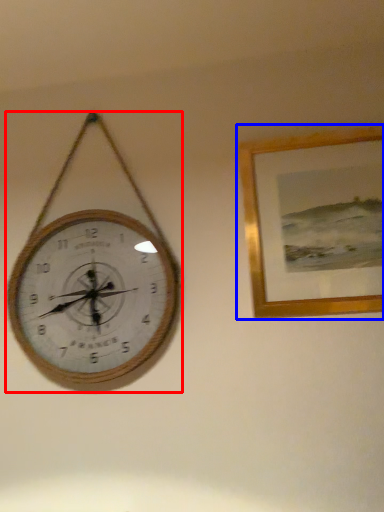
Question: Which object is further to the camera taking this photo, wall clock (highlighted by a red box) or picture frame (highlighted by a blue box)?

Choices:
 (A) wall clock
 (B) picture frame

Answer: (A)